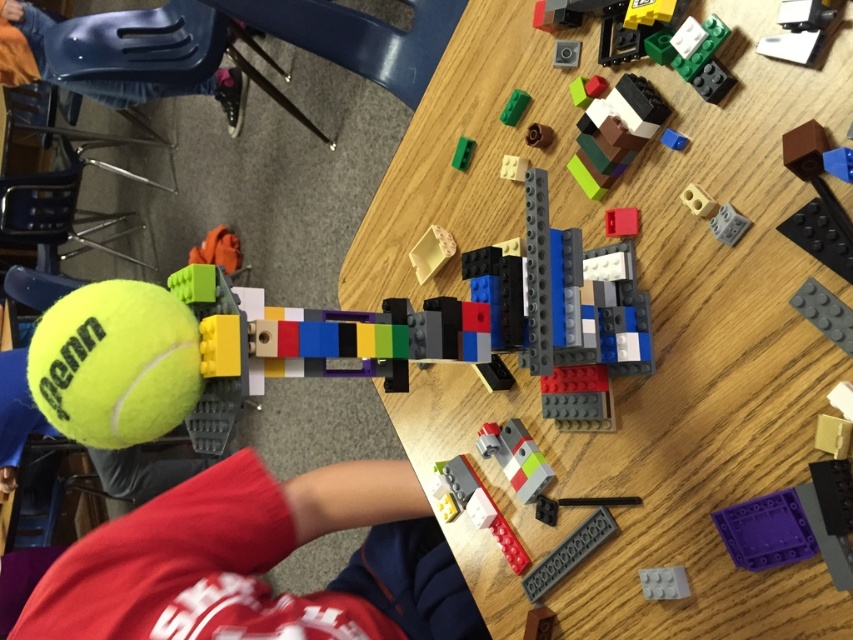
Is matte plastic brick at center above blue plastic square at upper right?

Correct, matte plastic brick at center is located above blue plastic square at upper right.

Between point (573, 58) and point (682, 147), which one is positioned in front?

Point (682, 147) is in front.

Identify the location of matte plastic brick at center. The height and width of the screenshot is (640, 853). (566, 52).

At what (x,y) coordinates should I click in order to perform the action: click on matte plastic brick at center. Please return your answer as a coordinate pair (x, y). This screenshot has height=640, width=853. Looking at the image, I should click on (566, 52).

Which of these two, blue plastic chair at upper left or green plastic brick at upper center, stands shorter?

With less height is green plastic brick at upper center.

Can you confirm if blue plastic chair at upper left is wider than green plastic brick at upper center?

Yes.

Identify the location of blue plastic chair at upper left. (97, 81).

You are a GUI agent. You are given a task and a screenshot of the screen. Output one action in this format:
    pyautogui.click(x=<x>, y=<y>)
    Task: Click on the blue plastic chair at upper left
    
    Given the screenshot: What is the action you would take?
    pyautogui.click(x=97, y=81)

Between metallic silver stapler at upper right and translucent beige plastic at center, which one is positioned higher?

metallic silver stapler at upper right is above.

Measure the distance from metallic silver stapler at upper right to translucent beige plastic at center.

A distance of 21.50 inches exists between metallic silver stapler at upper right and translucent beige plastic at center.

Who is more forward, (769, 51) or (445, 241)?

Positioned in front is point (769, 51).

In order to click on metallic silver stapler at upper right in this screenshot , I will do `click(799, 29)`.